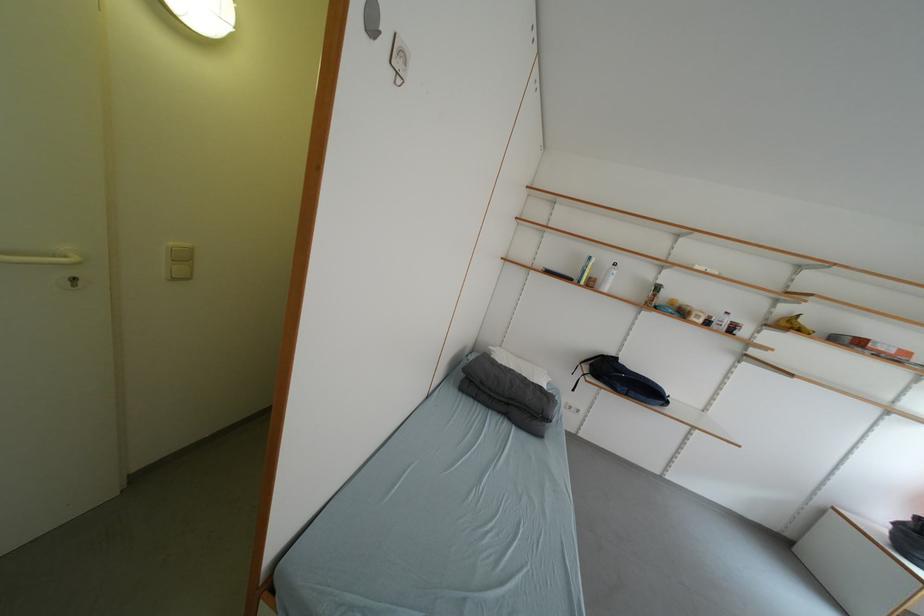
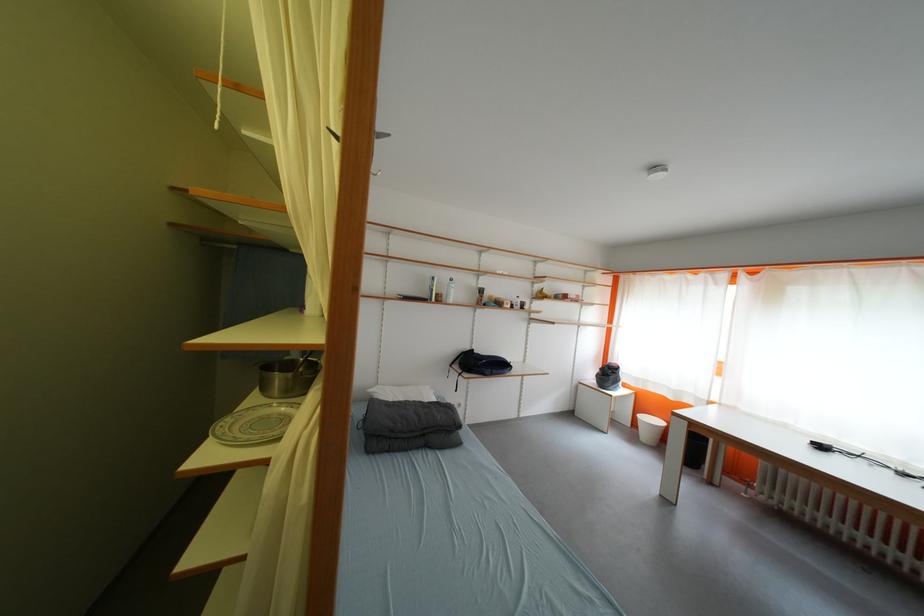
Question: I am providing you with two images of the same scene from different viewpoints. Please identify which objects are invisible in image2.

Choices:
 (A) patterned plate
 (B) white trash can
 (C) black backpack
 (D) none of these

Answer: (D)